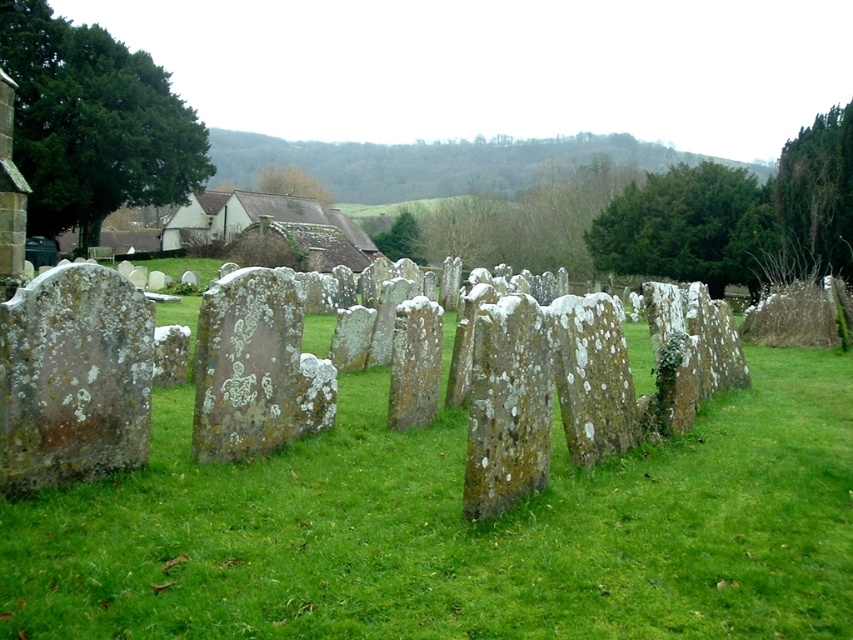
Is speckled stone at left positioned at the back of green mossy stone at center?

No, it is not.

Who is higher up, speckled stone at left or green mossy stone at center?

speckled stone at left is higher up.

Is point (54, 445) less distant than point (503, 298)?

Yes, it is.

Identify the location of speckled stone at left. (73, 378).

Who is more forward, (468, 426) or (581, 412)?

Point (468, 426) is more forward.

Between green mossy stone at center and speckled mossy tombstone at center, which one appears on the left side from the viewer's perspective?

Positioned to the left is green mossy stone at center.

This screenshot has height=640, width=853. Identify the location of green mossy stone at center. (508, 406).

Does speckled mossy tombstone at center have a greater width compared to speckled stone at center?

Indeed, speckled mossy tombstone at center has a greater width compared to speckled stone at center.

At what (x,y) coordinates should I click in order to perform the action: click on speckled mossy tombstone at center. Please return your answer as a coordinate pair (x, y). Looking at the image, I should click on pos(592,378).

Does point (582, 416) come in front of point (405, 333)?

Yes.

Locate an element on the screen. This screenshot has width=853, height=640. speckled mossy tombstone at center is located at coordinates (592, 378).